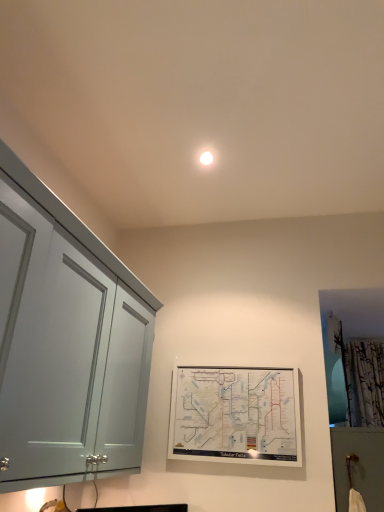
The image size is (384, 512). I want to click on white matte map at center, so click(x=235, y=415).

What do you see at coordinates (235, 415) in the screenshot? The width and height of the screenshot is (384, 512). I see `white matte map at center` at bounding box center [235, 415].

What is the approximate height of white matte map at center?

white matte map at center is 18.24 inches in height.

What is the approximate width of white matte map at center?

The width of white matte map at center is 5.45 centimeters.

Where is `white matte map at center`? white matte map at center is located at coordinates (235, 415).